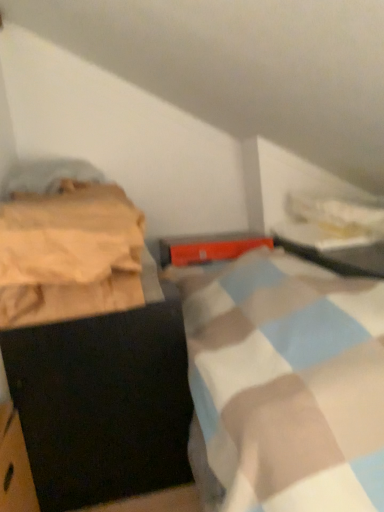
Question: Looking at the image, does metallic silver table at upper right seem bigger or smaller compared to beige cotton blanket at left?

Choices:
 (A) big
 (B) small

Answer: (A)

Question: From a real-world perspective, is metallic silver table at upper right physically located above or below beige cotton blanket at left?

Choices:
 (A) below
 (B) above

Answer: (A)

Question: Which is farther from the beige cotton blanket at left?

Choices:
 (A) black matte cabinet at left
 (B) metallic silver table at upper right

Answer: (B)

Question: Which is nearer to the metallic silver table at upper right?

Choices:
 (A) black matte cabinet at left
 (B) beige cotton blanket at left

Answer: (A)